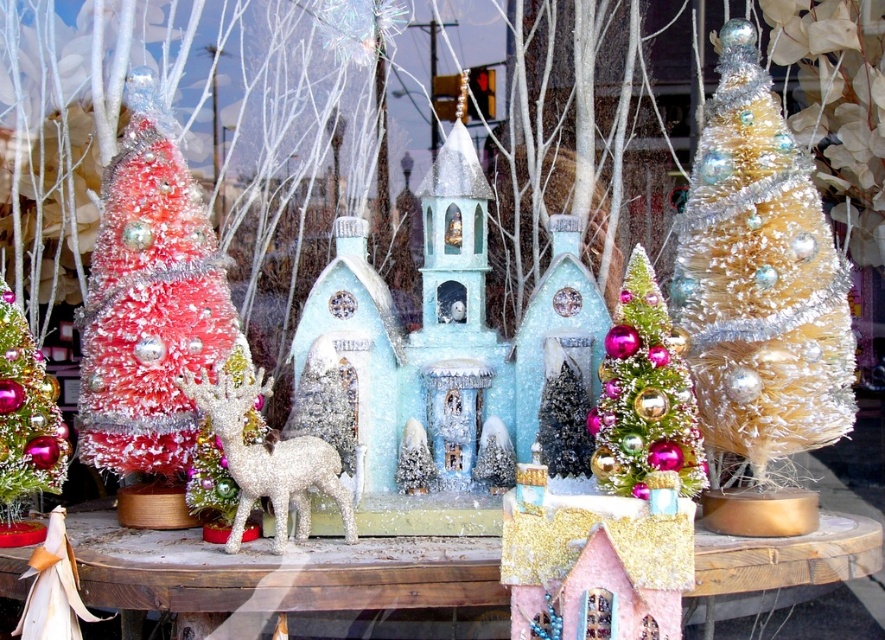
You are a customer looking at the festive display in the shop window. You see the shiny pink tinsel christmas tree at center and the glittery silver deer at center. Which object is located to the left of the other?

The glittery silver deer at center is located to the left of the shiny pink tinsel christmas tree at center because the tree is positioned on the right side of the deer.

You are a customer standing in front of the shop window. You see the gold tinsel christmas tree at right. Where is it located in the display?

The gold tinsel christmas tree at right is located at the point with coordinates 0.434 on the x axis and 0.860 on the y axis.